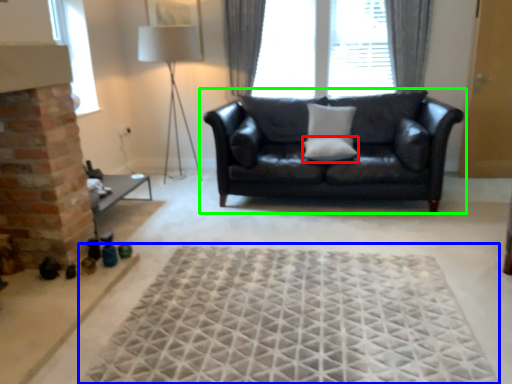
Question: Considering the real-world distances, which object is farthest from pillow (highlighted by a red box)? mat (highlighted by a blue box) or studio couch (highlighted by a green box)?

Choices:
 (A) mat
 (B) studio couch

Answer: (A)